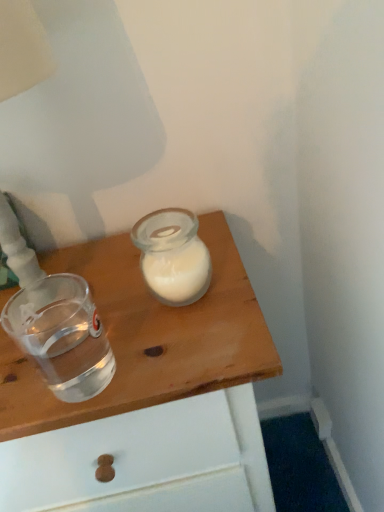
Question: Is the position of transparent plastic shot glass at left more distant than that of transparent glass at upper center?

Choices:
 (A) no
 (B) yes

Answer: (A)

Question: Is transparent plastic shot glass at left positioned far away from transparent glass at upper center?

Choices:
 (A) yes
 (B) no

Answer: (B)

Question: From a real-world perspective, is transparent plastic shot glass at left physically above transparent glass at upper center?

Choices:
 (A) yes
 (B) no

Answer: (A)

Question: Could you tell me if transparent plastic shot glass at left is facing transparent glass at upper center?

Choices:
 (A) yes
 (B) no

Answer: (B)

Question: Is transparent plastic shot glass at left wider than transparent glass at upper center?

Choices:
 (A) yes
 (B) no

Answer: (B)

Question: Does transparent plastic shot glass at left have a lesser height compared to transparent glass at upper center?

Choices:
 (A) yes
 (B) no

Answer: (A)

Question: Does transparent glass at upper center have a lesser width compared to transparent plastic shot glass at left?

Choices:
 (A) no
 (B) yes

Answer: (A)

Question: Does transparent glass at upper center have a lesser height compared to transparent plastic shot glass at left?

Choices:
 (A) no
 (B) yes

Answer: (A)

Question: From a real-world perspective, is transparent glass at upper center on top of transparent plastic shot glass at left?

Choices:
 (A) yes
 (B) no

Answer: (B)

Question: Is transparent glass at upper center to the right of transparent plastic shot glass at left from the viewer's perspective?

Choices:
 (A) no
 (B) yes

Answer: (B)

Question: From a real-world perspective, is transparent glass at upper center located beneath transparent plastic shot glass at left?

Choices:
 (A) yes
 (B) no

Answer: (A)

Question: From the image's perspective, is transparent glass at upper center located beneath transparent plastic shot glass at left?

Choices:
 (A) yes
 (B) no

Answer: (A)

Question: Would you say transparent glass at upper center is to the left or to the right of transparent plastic shot glass at left in the picture?

Choices:
 (A) left
 (B) right

Answer: (B)